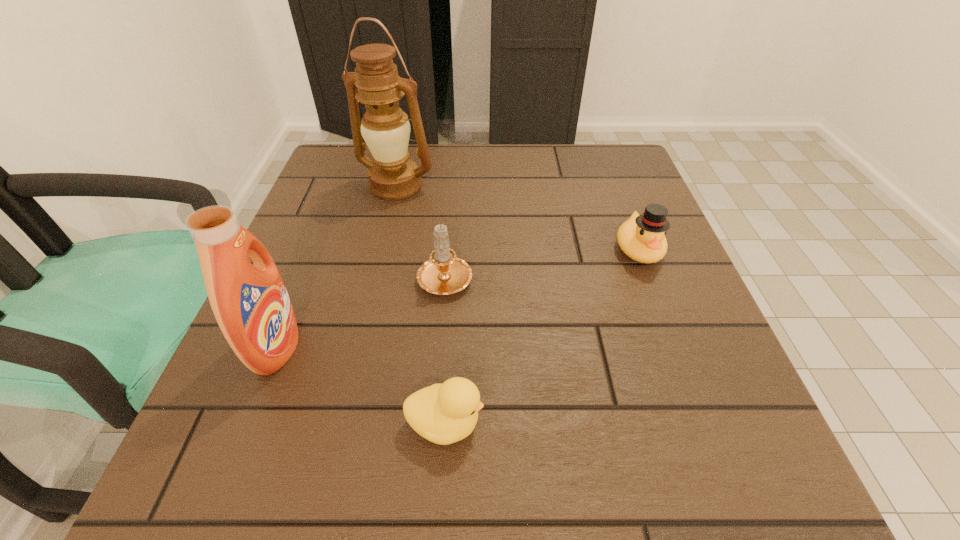
Locate an element on the screen. blank area at the far edge is located at coordinates 527,145.

At what (x,y) coordinates should I click in order to perform the action: click on free space at the near edge of the desktop. Please return your answer as a coordinate pair (x, y). Looking at the image, I should click on (539, 468).

This screenshot has height=540, width=960. I want to click on vacant area at the left edge of the desktop, so click(x=328, y=340).

This screenshot has height=540, width=960. In the image, there is a desktop. Find the location of `free space at the right edge`. free space at the right edge is located at coordinates (641, 372).

Locate an element on the screen. free space at the far left corner is located at coordinates (347, 186).

The width and height of the screenshot is (960, 540). I want to click on vacant space at the far right corner of the desktop, so click(x=609, y=144).

Find the location of a particular element. Image resolution: width=960 pixels, height=540 pixels. free space at the near right corner of the desktop is located at coordinates (723, 477).

Where is `free space between the candle and the farthest object`? free space between the candle and the farthest object is located at coordinates (420, 231).

Locate an element on the screen. Image resolution: width=960 pixels, height=540 pixels. vacant space that's between the oil lamp and the second nearest object is located at coordinates (337, 266).

The image size is (960, 540). In order to click on free space between the detergent and the candle in this screenshot , I will do `click(361, 312)`.